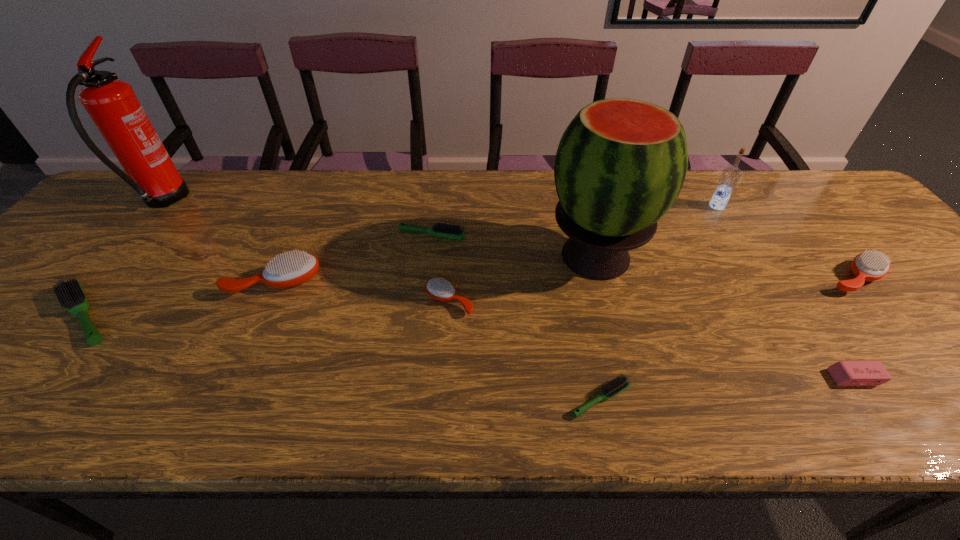
The height and width of the screenshot is (540, 960). Find the location of `free location that satisfies the following two spatial constraints: 1. on the front side of the farthest hairbrush; 2. on the left side of the smallest light hairbrush`. free location that satisfies the following two spatial constraints: 1. on the front side of the farthest hairbrush; 2. on the left side of the smallest light hairbrush is located at coordinates (413, 399).